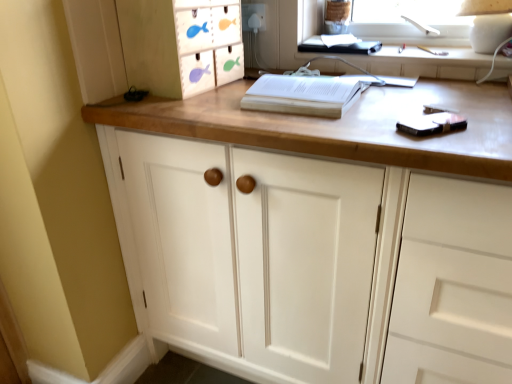
Question: From a real-world perspective, relative to white plastic electric outlet at upper center, is white paper at center vertically above or below?

Choices:
 (A) below
 (B) above

Answer: (A)

Question: In the image, is white paper at center positioned in front of or behind white plastic electric outlet at upper center?

Choices:
 (A) behind
 (B) front

Answer: (B)

Question: Considering the real-world distances, which object is closest to the white wood cabinet at center?

Choices:
 (A) wooden fish-themed drawer at upper left
 (B) white plastic electric outlet at upper center
 (C) white paper at center

Answer: (C)

Question: Which is farther from the wooden fish-themed drawer at upper left?

Choices:
 (A) white paper at center
 (B) white plastic electric outlet at upper center
 (C) white wood cabinet at center

Answer: (B)